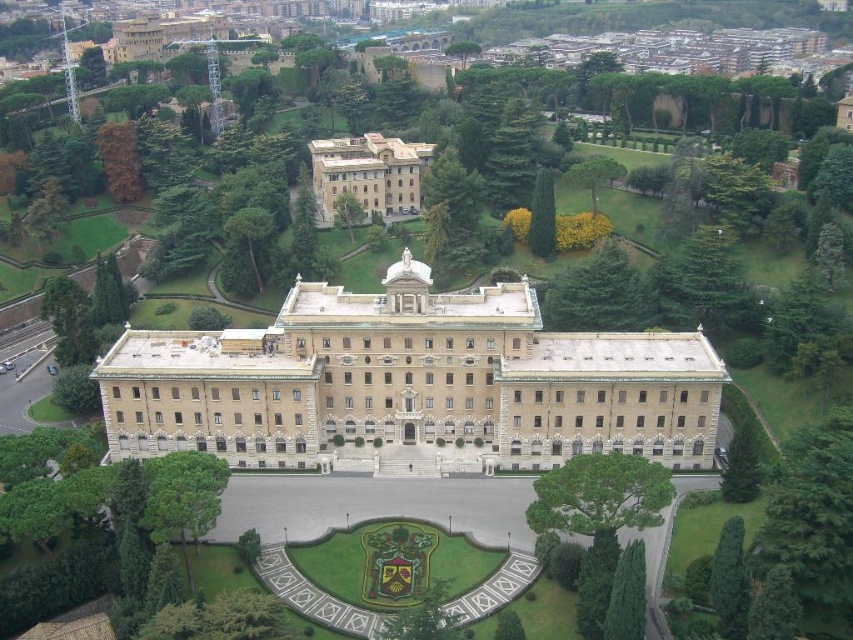
Question: Among these points, which one is nearest to the camera?

Choices:
 (A) (329, 161)
 (B) (596, 348)

Answer: (B)

Question: Which of the following is the closest to the observer?

Choices:
 (A) beige stone building at upper center
 (B) beige stone palace at center

Answer: (B)

Question: Is beige stone palace at center to the right of beige stone building at upper center from the viewer's perspective?

Choices:
 (A) yes
 (B) no

Answer: (A)

Question: Does beige stone palace at center lie behind beige stone building at upper center?

Choices:
 (A) yes
 (B) no

Answer: (B)

Question: Is beige stone palace at center to the right of beige stone building at upper center from the viewer's perspective?

Choices:
 (A) yes
 (B) no

Answer: (A)